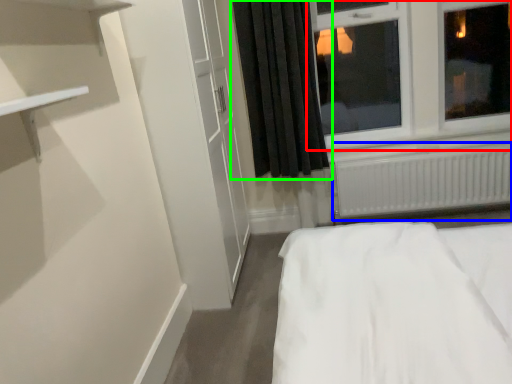
Question: Which object is positioned closest to window (highlighted by a red box)? Select from radiator (highlighted by a blue box) and curtain (highlighted by a green box).

Choices:
 (A) radiator
 (B) curtain

Answer: (A)